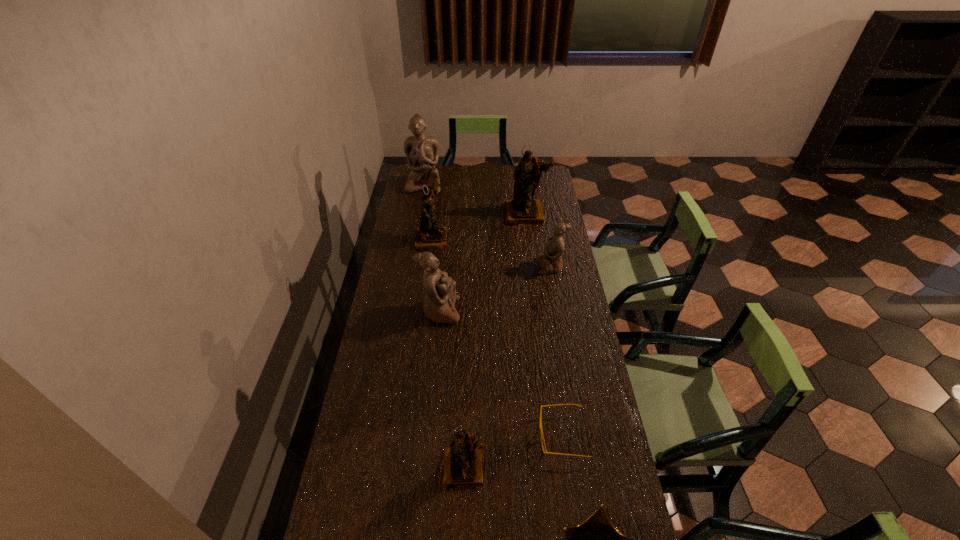
Locate an element on the screen. Image resolution: width=960 pixels, height=540 pixels. free space at the right edge of the desktop is located at coordinates (552, 276).

The width and height of the screenshot is (960, 540). What are the coordinates of `free space between the farthest white figurine and the nearest figurine` in the screenshot? It's located at coord(444,326).

At what (x,y) coordinates should I click in order to perform the action: click on vacant point located between the fourth nearest figurine and the rightmost gold figurine. Please return your answer as a coordinate pair (x, y). The height and width of the screenshot is (540, 960). Looking at the image, I should click on (479, 226).

This screenshot has height=540, width=960. I want to click on vacant space that is in between the smallest white figurine and the fourth nearest object, so click(x=495, y=288).

This screenshot has height=540, width=960. I want to click on unoccupied area between the fifth nearest figurine and the second biggest white figurine, so click(x=483, y=262).

Find the location of a particular element. free space that is in between the sixth nearest object and the second nearest white figurine is located at coordinates [492, 252].

What are the coordinates of `free space between the smallest white figurine and the beige spectacles` in the screenshot? It's located at (557, 351).

Locate an element on the screen. The width and height of the screenshot is (960, 540). free point between the nearest white figurine and the biggest gold figurine is located at coordinates (483, 262).

The width and height of the screenshot is (960, 540). What are the coordinates of `object that is the third closest to the crown` in the screenshot? It's located at (440, 296).

Locate an element on the screen. object that is the closest to the spectacles is located at coordinates (599, 520).